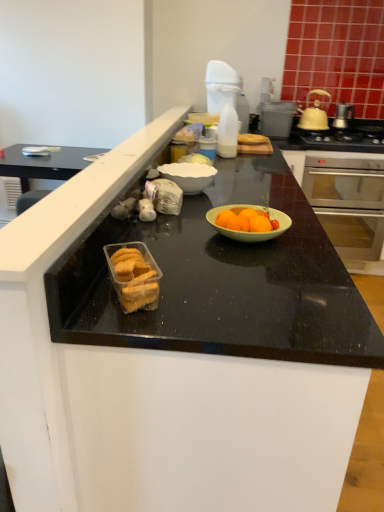
Question: Is stainless steel oven at right positioned with its back to translucent plastic bottle at upper center?

Choices:
 (A) no
 (B) yes

Answer: (A)

Question: From a real-world perspective, is stainless steel oven at right on top of translucent plastic bottle at upper center?

Choices:
 (A) yes
 (B) no

Answer: (B)

Question: Are stainless steel oven at right and translucent plastic bottle at upper center located far from each other?

Choices:
 (A) yes
 (B) no

Answer: (B)

Question: From the image's perspective, is stainless steel oven at right below translucent plastic bottle at upper center?

Choices:
 (A) yes
 (B) no

Answer: (A)

Question: From the image's perspective, is stainless steel oven at right on translucent plastic bottle at upper center?

Choices:
 (A) no
 (B) yes

Answer: (A)

Question: From the image's perspective, relative to translucent plastic container of cookies at center, is stainless steel oven at right above or below?

Choices:
 (A) above
 (B) below

Answer: (A)

Question: From a real-world perspective, is stainless steel oven at right above or below translucent plastic container of cookies at center?

Choices:
 (A) above
 (B) below

Answer: (B)

Question: Is stainless steel oven at right in front of or behind translucent plastic container of cookies at center in the image?

Choices:
 (A) behind
 (B) front

Answer: (A)

Question: Considering the positions of stainless steel oven at right and translucent plastic container of cookies at center in the image, is stainless steel oven at right wider or thinner than translucent plastic container of cookies at center?

Choices:
 (A) thin
 (B) wide

Answer: (B)

Question: Is point (301, 117) positioned closer to the camera than point (208, 89)?

Choices:
 (A) farther
 (B) closer

Answer: (A)

Question: Is yellow matte pot at upper right, positioned as the 1th pot/pan in left-to-right order, in front of or behind white plastic spray bottle at upper center in the image?

Choices:
 (A) behind
 (B) front

Answer: (A)

Question: From a real-world perspective, relative to white plastic spray bottle at upper center, is yellow matte pot at upper right, arranged as the second pot/pan when viewed from the right, vertically above or below?

Choices:
 (A) below
 (B) above

Answer: (A)

Question: Which is correct: yellow matte pot at upper right, positioned as the 1th pot/pan in left-to-right order, is inside white plastic spray bottle at upper center, or outside of it?

Choices:
 (A) inside
 (B) outside

Answer: (B)

Question: In the image, is translucent plastic container of cookies at center on the left side or the right side of silver metallic pot at upper right, marked as the 1th pot/pan in a right-to-left arrangement?

Choices:
 (A) right
 (B) left

Answer: (B)

Question: Looking at their shapes, would you say translucent plastic container of cookies at center is wider or thinner than silver metallic pot at upper right, acting as the 2th pot/pan starting from the left?

Choices:
 (A) thin
 (B) wide

Answer: (A)